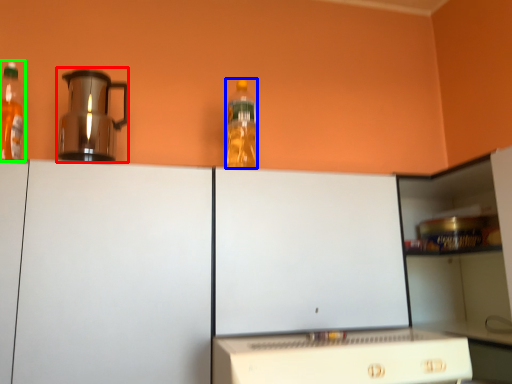
Question: Estimate the real-world distances between objects in this image. Which object is closer to kitchen appliance (highlighted by a red box), bottle (highlighted by a blue box) or bottle (highlighted by a green box)?

Choices:
 (A) bottle
 (B) bottle

Answer: (B)